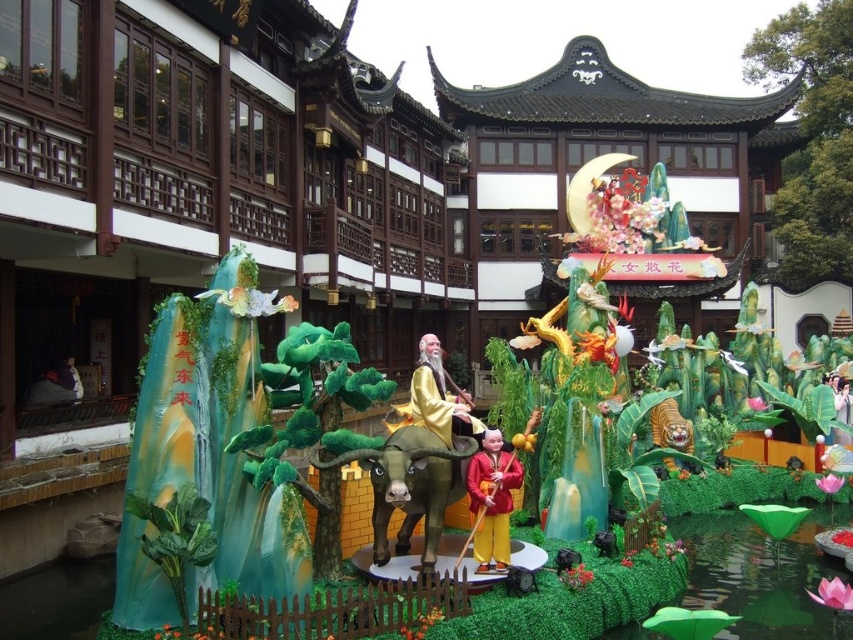
You are an artist trying to sketch the float. You need to place the green matte ox at center and the gold shiny robe at center in your drawing. According to the scene, which object should be drawn to the left side of the other?

The green matte ox at center should be drawn to the left side of the gold shiny robe at center because the description states that the green matte ox at center is positioned on the left side of the gold shiny robe at center.

You are an event planner arranging a traditional Chinese festival. You need to place a 3D model of a dragon statue that is 2 meters wide. The dragon must be placed in the foreground where the green matte ox at center and smooth red fabric at center are located. Given their sizes, can the dragon statue fit between them without overlapping?

The green matte ox at center has a larger size compared to the smooth red fabric at center. Since the dragon statue is 2 meters wide, it depends on the actual space between them. However, since the ox is larger, there might be sufficient space. But without exact measurements of the distance between them, we cannot confirm. The answer is inconclusive based on the given information.

You are a stage designer working on a traditional Chinese float. You need to ensure that the green matte ox at center and the gold shiny robe at center are positioned so that they are within a 3.5 meter safety distance for the performers. Based on the image, are they within the required distance?

The green matte ox at center is 3.44 meters from the gold shiny robe at center, which is within the 3.5 meter safety distance requirement. Therefore, the positioning meets the safety standards.